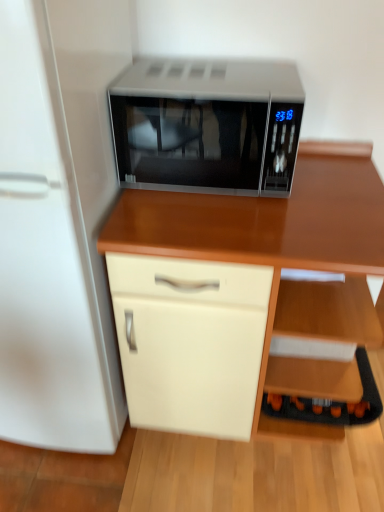
Question: Considering the positions of white glossy refrigerator at left and sleek silver microwave at center in the image, is white glossy refrigerator at left bigger or smaller than sleek silver microwave at center?

Choices:
 (A) small
 (B) big

Answer: (B)

Question: Considering the relative positions of white glossy refrigerator at left and sleek silver microwave at center in the image provided, is white glossy refrigerator at left to the left or to the right of sleek silver microwave at center?

Choices:
 (A) left
 (B) right

Answer: (A)

Question: Which object is positioned closest to the white glossy refrigerator at left?

Choices:
 (A) sleek silver microwave at center
 (B) wooden desk at center
 (C) black plastic shelf at lower right

Answer: (A)

Question: Estimate the real-world distances between objects in this image. Which object is closer to the wooden desk at center?

Choices:
 (A) sleek silver microwave at center
 (B) black plastic shelf at lower right
 (C) white glossy refrigerator at left

Answer: (B)